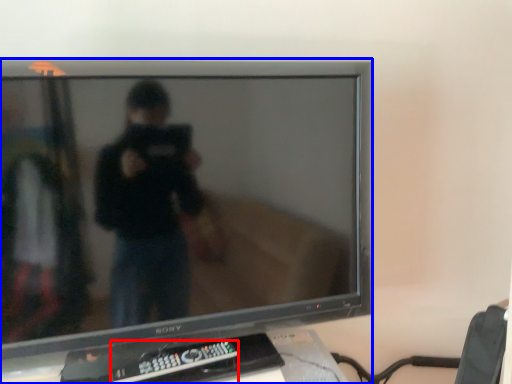
Question: Which of the following is the farthest to the observer, remote control (highlighted by a red box) or television (highlighted by a blue box)?

Choices:
 (A) remote control
 (B) television

Answer: (A)